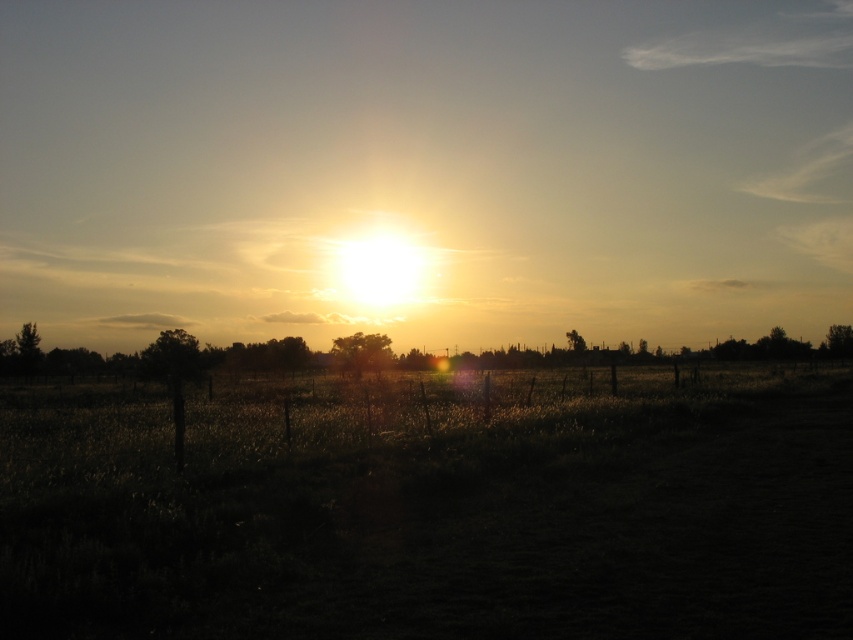
Between golden sky at center and dark grass at center, which one is positioned lower?

dark grass at center

Between golden sky at center and dark grass at center, which one has more height?

golden sky at center

Between point (415, 248) and point (550, 412), which one is positioned behind?

The point (415, 248) is behind.

The image size is (853, 640). What are the coordinates of `golden sky at center` in the screenshot? It's located at pos(425,168).